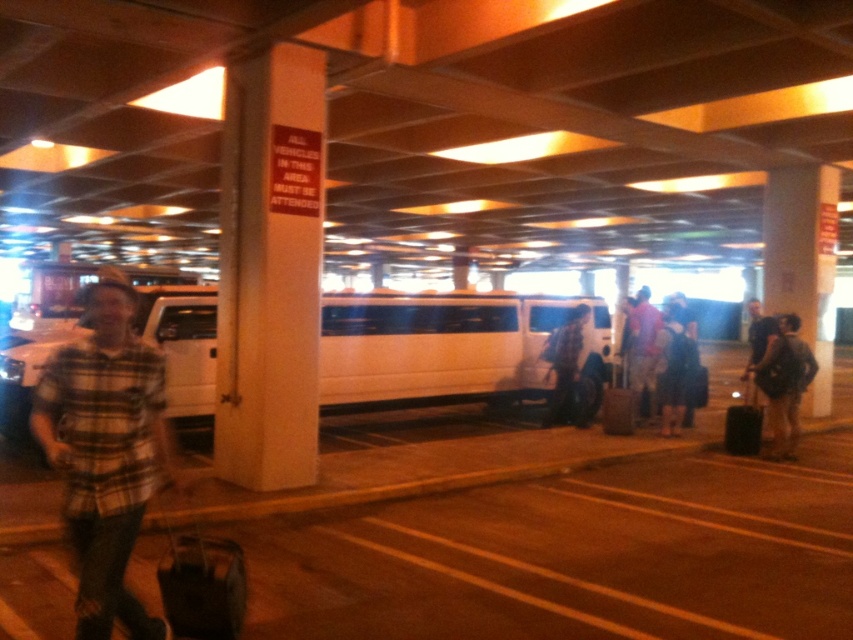
You are standing at the entrance of the parking garage and see a person in a light blue shirt at center and a black matte suitcase at lower right. Which object is positioned to the right side?

The light blue shirt at center is positioned to the right of the black matte suitcase at lower right.

You are standing at the point marked by the coordinates point (448, 346). Based on the scene description, what object are you currently standing on?

The point (448, 346) is on the white matte van at center, so you are standing on the white matte van at center.

You are a security camera monitoring the parking garage. You notice a person in a light blue shirt at center and a black matte suitcase at lower right. Which object appears bigger in your field of view?

The light blue shirt at center appears bigger in the field of view as it is larger in size than the black matte suitcase at lower right.